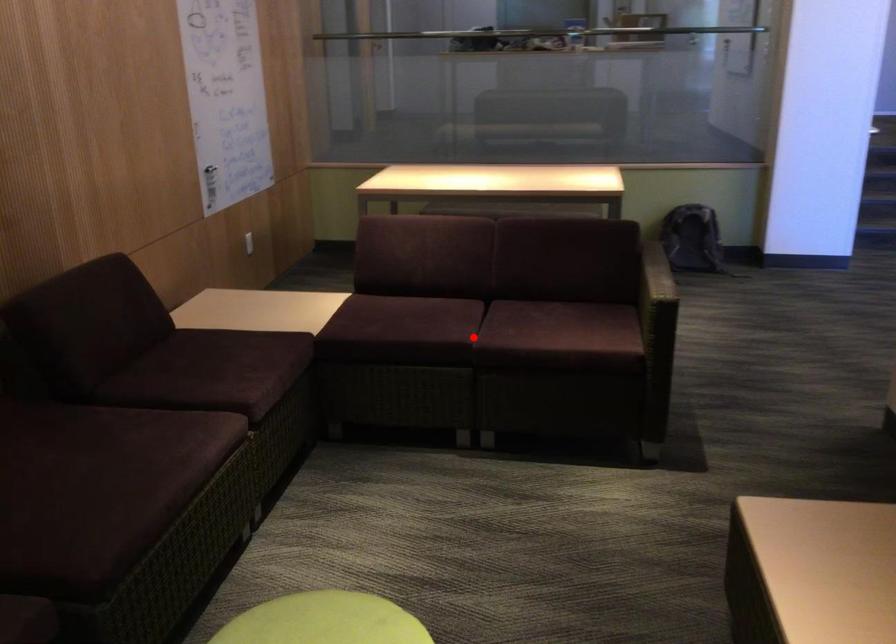
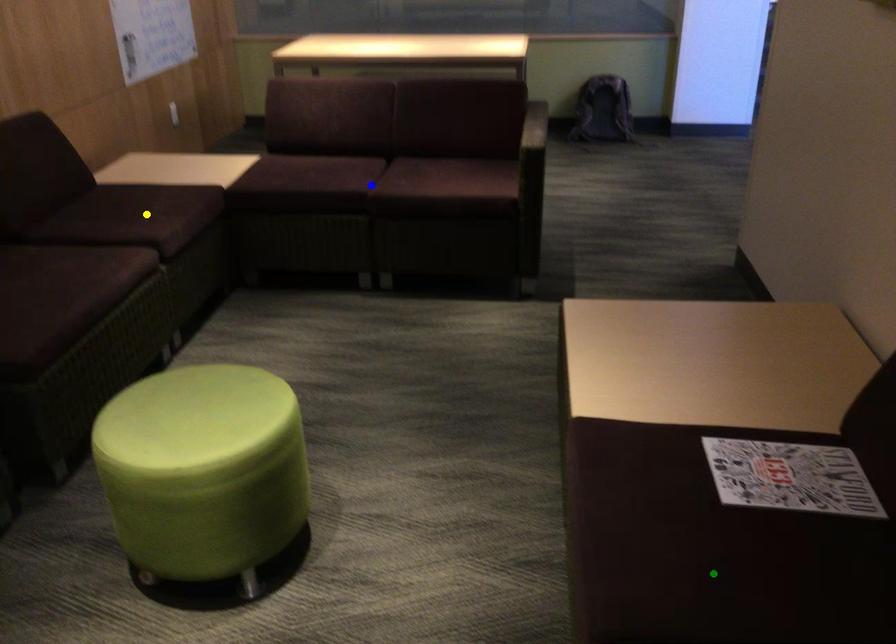
Question: I am providing you with two images of the same scene from different viewpoints. A red point is marked on the first image. You are given multiple points on the second image. Which mark in image 2 goes with the point in image 1?

Choices:
 (A) yellow point
 (B) blue point
 (C) green point

Answer: (B)